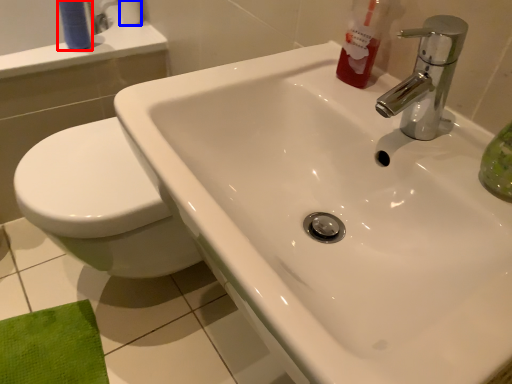
Question: Which point is closer to the camera, toiletry (highlighted by a red box) or toilet paper (highlighted by a blue box)?

Choices:
 (A) toiletry
 (B) toilet paper

Answer: (A)